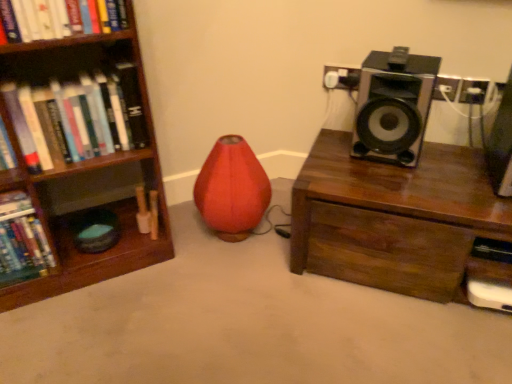
I want to click on free space to the left of metallic silver speaker at upper right, which ranks as the 2th speaker in left-to-right order, so click(x=453, y=178).